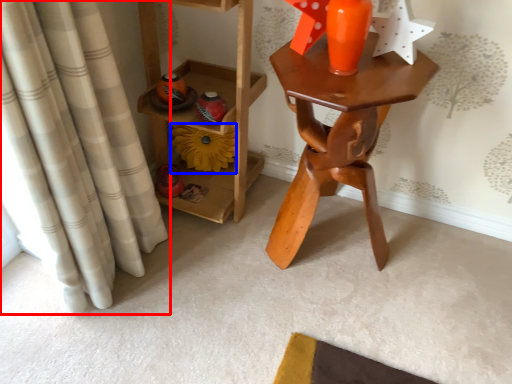
Question: Which point is closer to the camera, curtain (highlighted by a red box) or flower (highlighted by a blue box)?

Choices:
 (A) curtain
 (B) flower

Answer: (A)